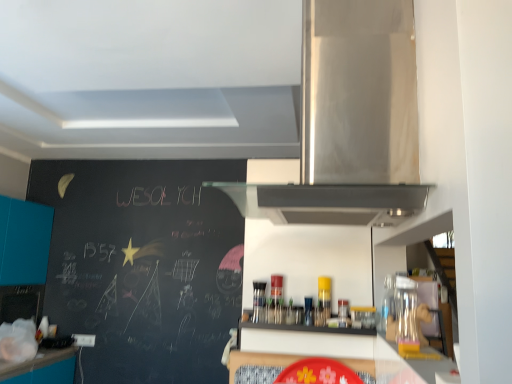
Where is `blank space above black matte shelf at center (from a real-world perspective)`? This screenshot has height=384, width=512. blank space above black matte shelf at center (from a real-world perspective) is located at coordinates (x=307, y=312).